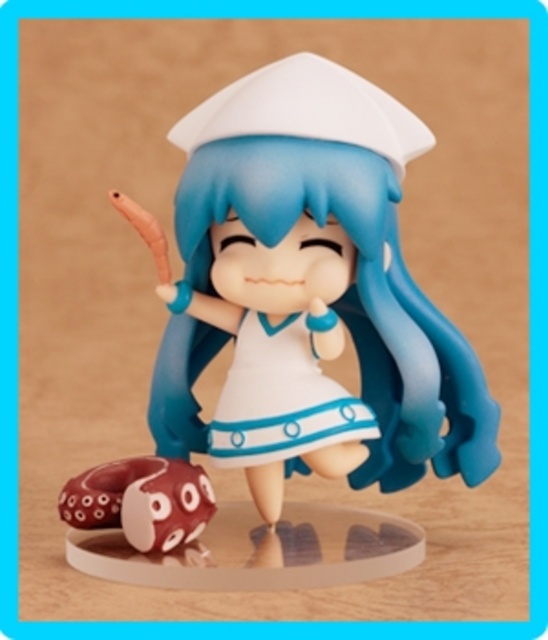
In the scene shown: You are a toy collector who wants to place the white glossy dress at center and the matte brown octopus at lower left on a shelf. The shelf has a width of 15 cm. Can both items fit side by side on the shelf without overlapping?

The white glossy dress at center might be wider than matte brown octopus at lower left, so it is uncertain if both items can fit side by side on the 15 cm shelf without overlapping. Measure their combined width to confirm.

You are an art curator arranging an exhibition. You have the white glossy dress at center and the matte brown octopus at lower left in front of you. Which object is taller?

The white glossy dress at center is taller than the matte brown octopus at lower left.